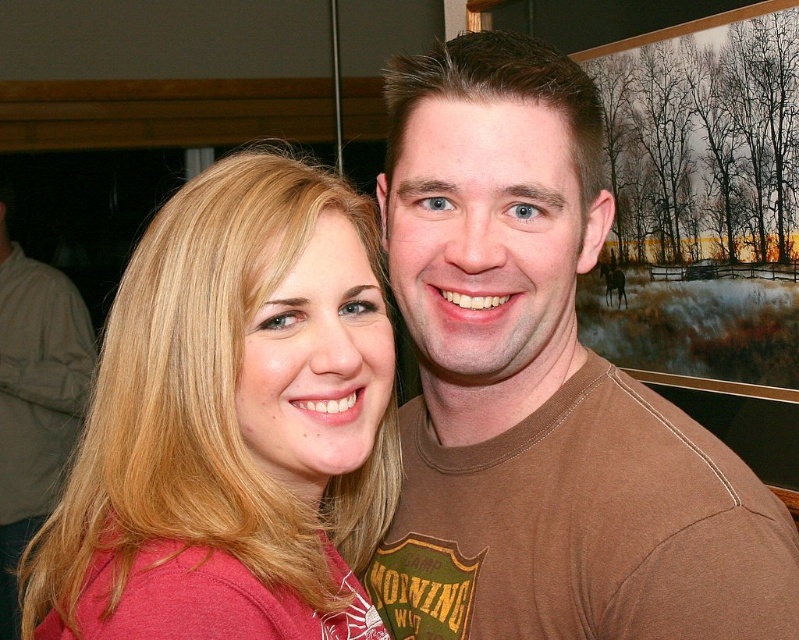
Which is in front, point (372, 320) or point (2, 390)?

Positioned in front is point (372, 320).

Does matte red shirt at left appear on the right side of blonde hair at left?

Correct, you'll find matte red shirt at left to the right of blonde hair at left.

I want to click on matte red shirt at left, so click(x=231, y=424).